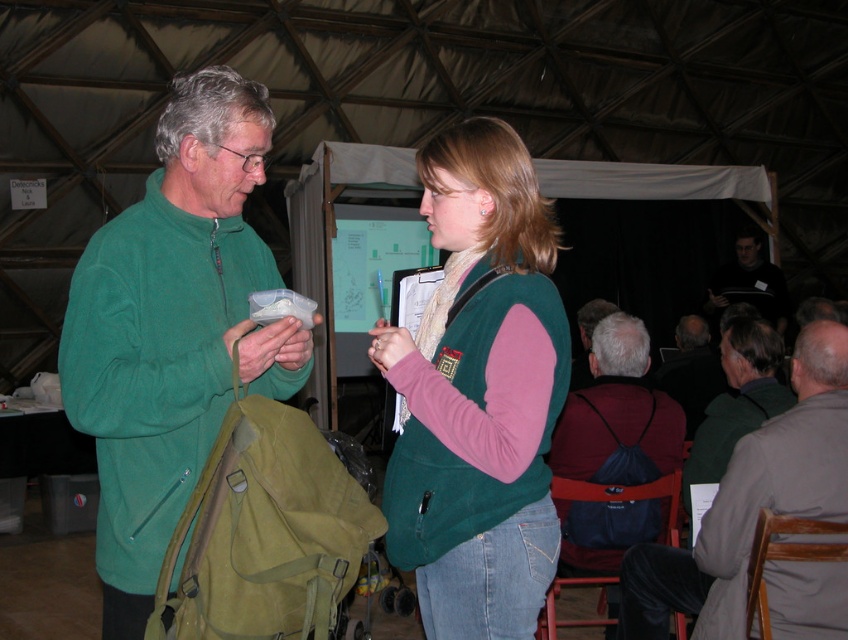
Looking at this image, you are organizing a conference and need to place a 3 meter long banner between the green fleece vest at center and the dark gray backpack at center. Will the banner fit between them?

The green fleece vest at center is 2.98 meters from the dark gray backpack at center, so the 3 meter long banner will not fit between them as it is slightly longer than the distance between the two objects.

You are organizing a conference and need to arrange the green fleece vest at center and the dark gray backpack at center for a presentation. Which item should be placed on the left side to match their current positions?

The green fleece vest at center should be placed on the left side since it is currently positioned on the left side of the dark gray backpack at center.